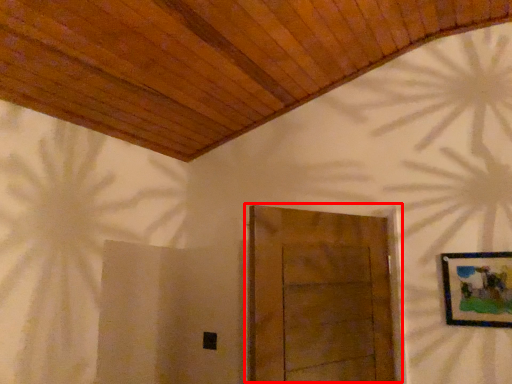
Question: Considering the relative positions of door (annotated by the red box) and picture frame in the image provided, where is door (annotated by the red box) located with respect to the staircase?

Choices:
 (A) left
 (B) right

Answer: (A)